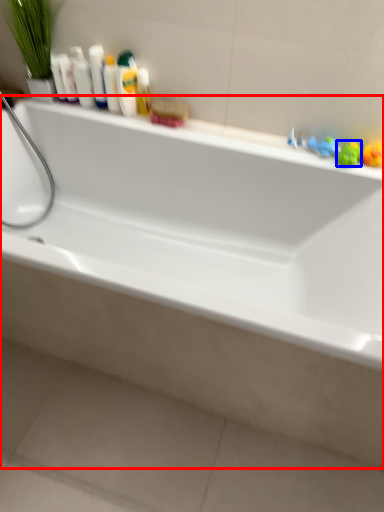
Question: Among these objects, which one is nearest to the camera, bathtub (highlighted by a red box) or toy (highlighted by a blue box)?

Choices:
 (A) bathtub
 (B) toy

Answer: (A)